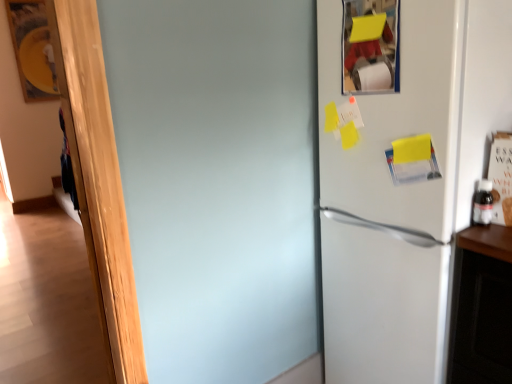
Question: Can you see white matte refrigerator at right touching transparent plastic bottle at right?

Choices:
 (A) no
 (B) yes

Answer: (A)

Question: Are white matte refrigerator at right and transparent plastic bottle at right located far from each other?

Choices:
 (A) yes
 (B) no

Answer: (B)

Question: From a real-world perspective, does white matte refrigerator at right sit lower than transparent plastic bottle at right?

Choices:
 (A) no
 (B) yes

Answer: (B)

Question: Is white matte refrigerator at right further to the viewer compared to transparent plastic bottle at right?

Choices:
 (A) yes
 (B) no

Answer: (B)

Question: Could transparent plastic bottle at right be considered to be inside white matte refrigerator at right?

Choices:
 (A) yes
 (B) no

Answer: (B)

Question: Does white matte refrigerator at right have a greater height compared to transparent plastic bottle at right?

Choices:
 (A) no
 (B) yes

Answer: (B)

Question: From the image's perspective, is transparent plastic bottle at right located beneath white matte refrigerator at right?

Choices:
 (A) yes
 (B) no

Answer: (B)

Question: Is transparent plastic bottle at right completely or partially outside of white matte refrigerator at right?

Choices:
 (A) no
 (B) yes

Answer: (B)

Question: Considering the relative sizes of transparent plastic bottle at right and white matte refrigerator at right in the image provided, is transparent plastic bottle at right bigger than white matte refrigerator at right?

Choices:
 (A) no
 (B) yes

Answer: (A)

Question: Is white matte refrigerator at right located within transparent plastic bottle at right?

Choices:
 (A) yes
 (B) no

Answer: (B)

Question: Does transparent plastic bottle at right have a lesser height compared to white matte refrigerator at right?

Choices:
 (A) no
 (B) yes

Answer: (B)

Question: Is transparent plastic bottle at right further to the viewer compared to white matte refrigerator at right?

Choices:
 (A) no
 (B) yes

Answer: (B)

Question: From a real-world perspective, is transparent plastic bottle at right above or below white matte refrigerator at right?

Choices:
 (A) below
 (B) above

Answer: (B)